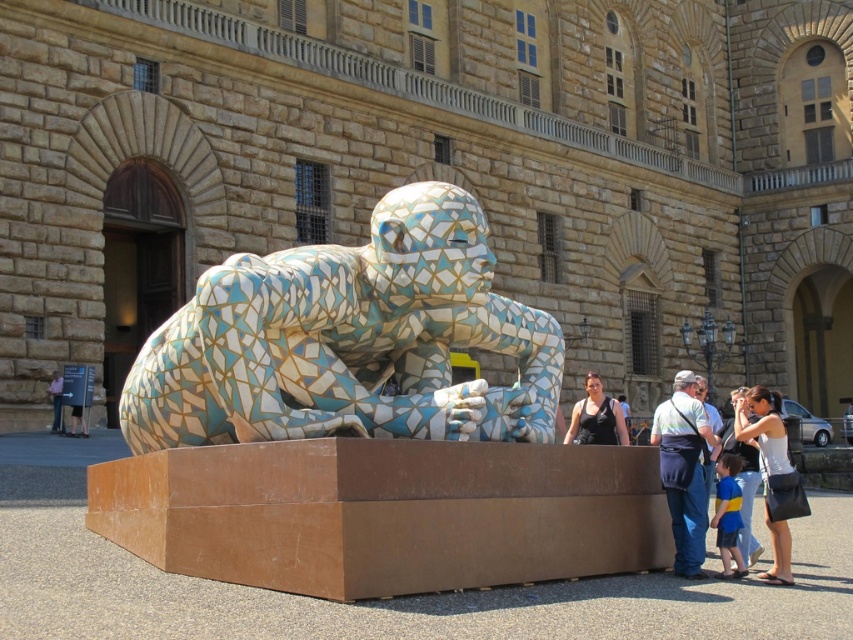
You are standing in front of the historic stone building and see the sculpture at point (347, 340). What is located at that coordinate?

The mosaic tile sculpture at center is located at point (347, 340).

You are standing in front of the historic stone building and want to take a photo of the mosaic tile sculpture at center. To ensure the sculpture is centered in your photo, where should you position yourself relative to the sculpture?

The mosaic tile sculpture at center is located at the coordinates 0.533 on the x axis and 0.409 on the y axis, so you should position yourself directly in front of the sculpture at those coordinates to center it in your photo.